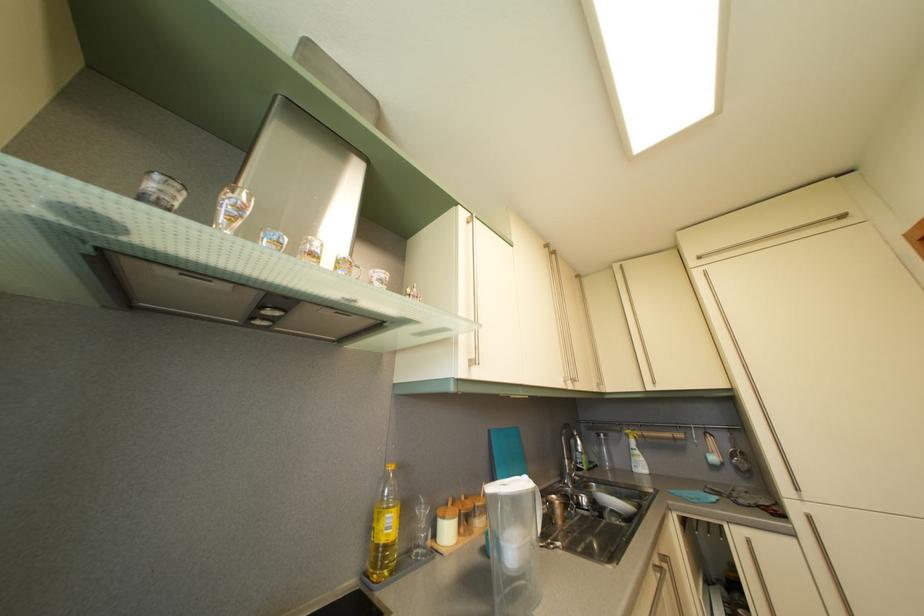
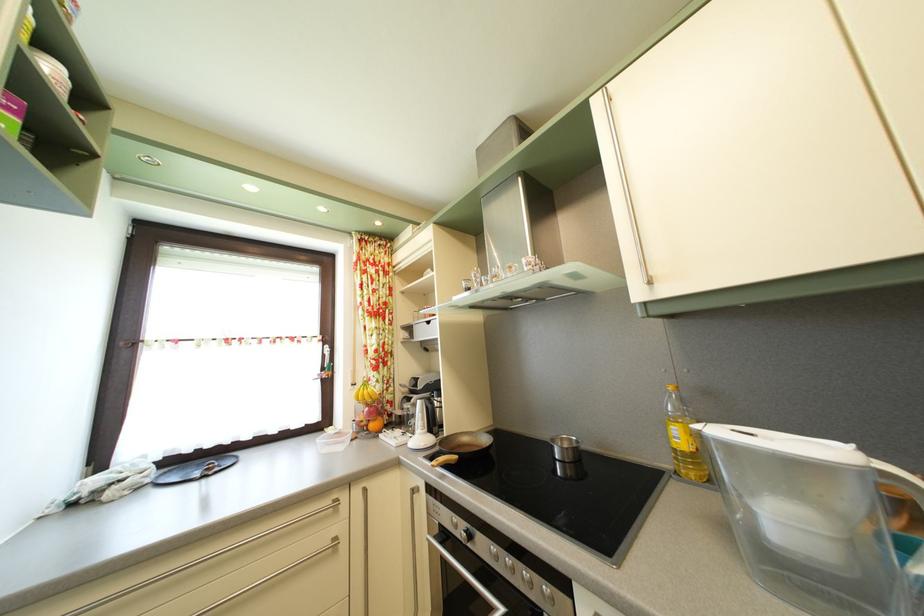
Question: The images are taken continuously from a first-person perspective. In which direction is your viewpoint rotating?

Choices:
 (A) Left
 (B) Right
 (C) Up
 (D) Down

Answer: (A)